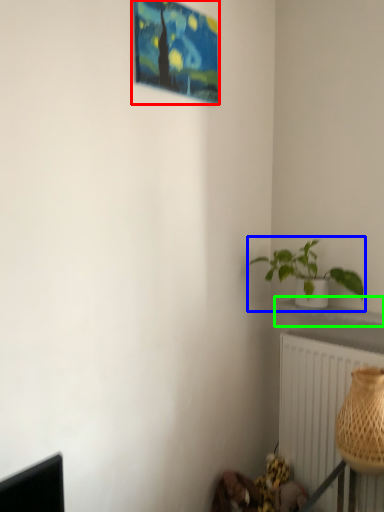
Question: Which is nearer to the picture frame (highlighted by a red box)? houseplant (highlighted by a blue box) or window sill (highlighted by a green box).

Choices:
 (A) houseplant
 (B) window sill

Answer: (A)